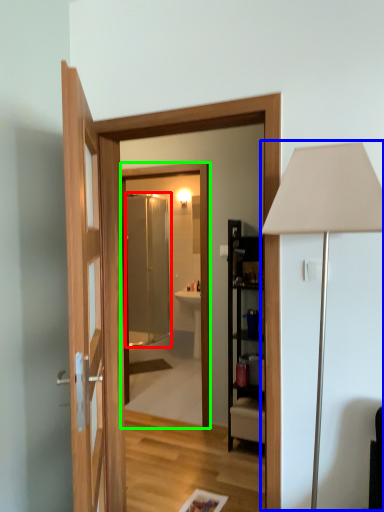
Question: Estimate the real-world distances between objects in this image. Which object is farther from screen door (highlighted by a red box), table lamp (highlighted by a blue box) or mirror (highlighted by a green box)?

Choices:
 (A) table lamp
 (B) mirror

Answer: (A)